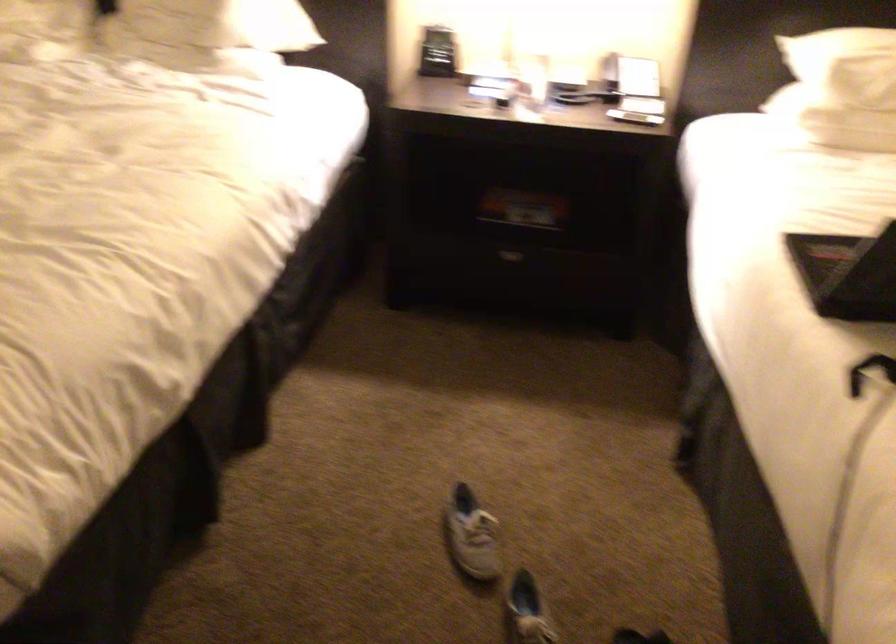
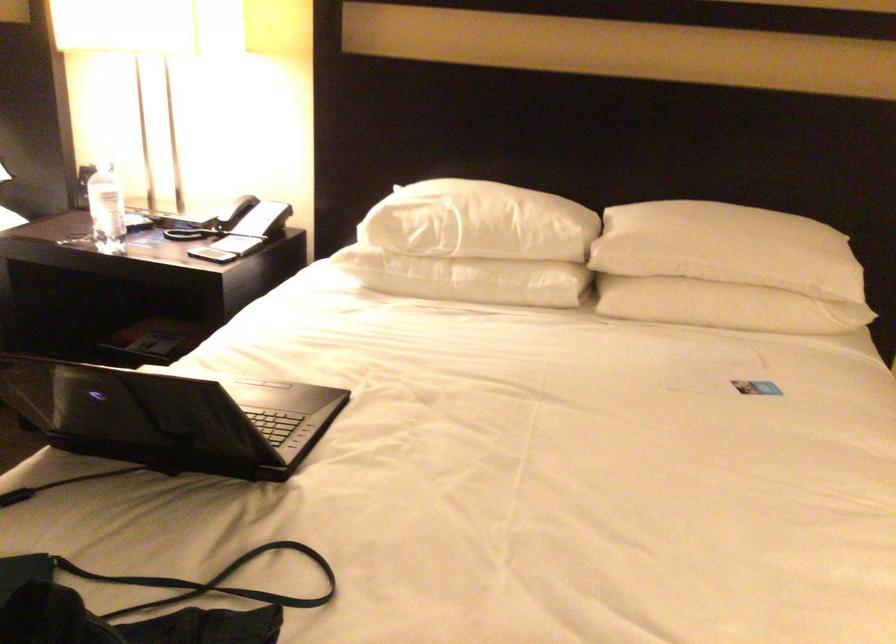
Question: I am providing you with two images of the same scene from different viewpoints. Please identify which objects are invisible in image2.

Choices:
 (A) hand grip handle
 (B) white pillow
 (C) drawer handle
 (D) black smartphone

Answer: (C)